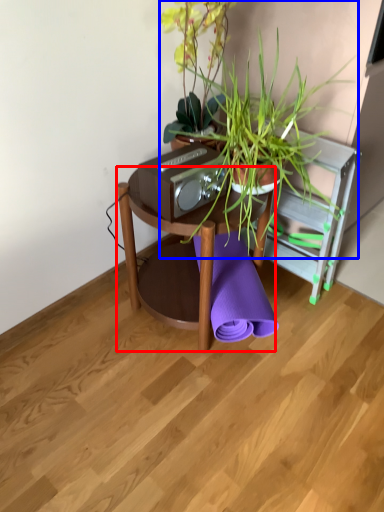
Question: Which point is further to the camera, table (highlighted by a red box) or houseplant (highlighted by a blue box)?

Choices:
 (A) table
 (B) houseplant

Answer: (A)